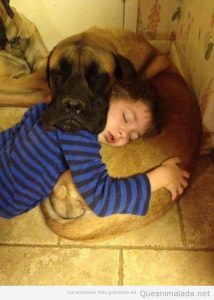
At what (x,y) coordinates should I click in order to perform the action: click on wallpaper. Please return your answer as a coordinate pair (x, y). The width and height of the screenshot is (214, 300). Looking at the image, I should click on (199, 27), (166, 16).